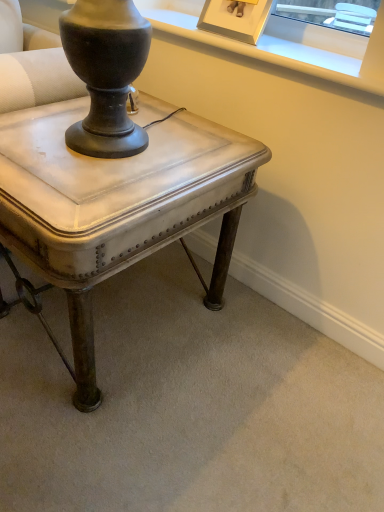
You are a GUI agent. You are given a task and a screenshot of the screen. Output one action in this format:
    pyautogui.click(x=<x>, y=<y>)
    Task: Click on the empty space that is ontop of metallic silver table at center (from a real-world perspective)
    
    Given the screenshot: What is the action you would take?
    (x=98, y=150)